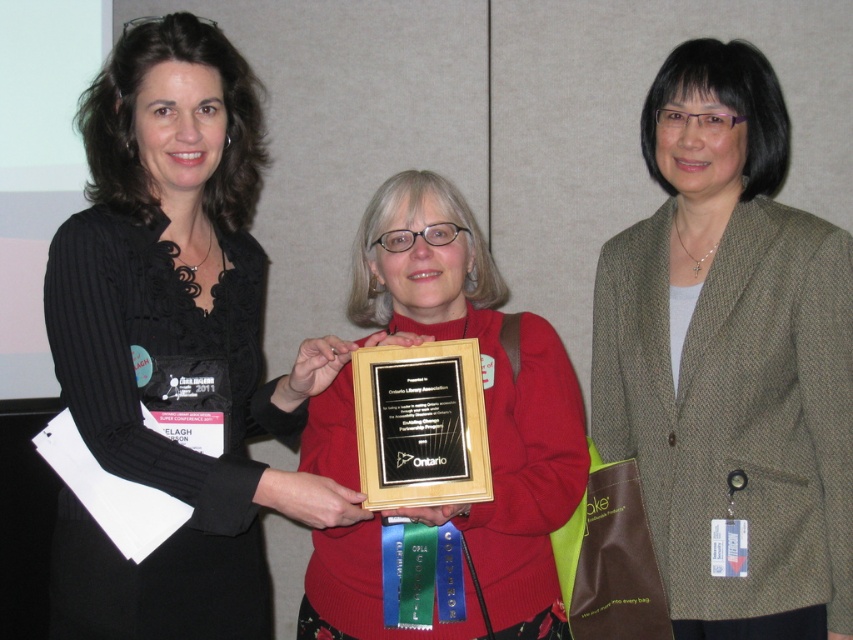
You are a photographer at the event and want to take a photo of the wooden plaque at center without the black ribbed sweater at upper left blocking it. How should you adjust your position?

Move your position to the right or left to avoid the black ribbed sweater at upper left, which is closer to the viewer than the wooden plaque at center.